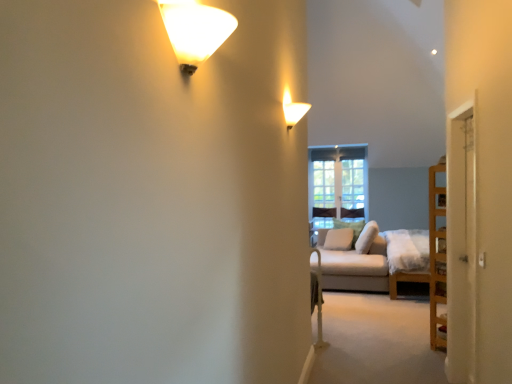
Question: Is white soft pillow at center, the 2th pillow when ordered from front to back, aimed at white fabric couch at right?

Choices:
 (A) no
 (B) yes

Answer: (A)

Question: Does white soft pillow at center, positioned as the second pillow in back-to-front order, appear on the right side of white fabric couch at right?

Choices:
 (A) yes
 (B) no

Answer: (B)

Question: Is white fabric couch at right a part of white soft pillow at center, the 2th pillow when ordered from front to back?

Choices:
 (A) no
 (B) yes

Answer: (A)

Question: Is white soft pillow at center, the 2th pillow when ordered from front to back, in contact with white fabric couch at right?

Choices:
 (A) yes
 (B) no

Answer: (B)

Question: Considering the relative sizes of white soft pillow at center, the 2th pillow when ordered from front to back, and white fabric couch at right in the image provided, is white soft pillow at center, the 2th pillow when ordered from front to back, shorter than white fabric couch at right?

Choices:
 (A) no
 (B) yes

Answer: (B)

Question: Does white soft pillow at center, the 2th pillow when ordered from front to back, have a greater height compared to white fabric couch at right?

Choices:
 (A) yes
 (B) no

Answer: (B)

Question: Can you confirm if matte white wall sconce at upper center, placed as the first lamp when sorted from back to front, is taller than white fabric pillow at center, which is counted as the third pillow, starting from the back?

Choices:
 (A) yes
 (B) no

Answer: (B)

Question: Is matte white wall sconce at upper center, placed as the first lamp when sorted from back to front, to the right of white fabric pillow at center, which is counted as the third pillow, starting from the back, from the viewer's perspective?

Choices:
 (A) no
 (B) yes

Answer: (A)

Question: Does matte white wall sconce at upper center, positioned as the first lamp in right-to-left order, turn towards white fabric pillow at center, which is counted as the third pillow, starting from the back?

Choices:
 (A) yes
 (B) no

Answer: (B)

Question: Would you say matte white wall sconce at upper center, placed as the 2th lamp when sorted from left to right, is outside white fabric pillow at center, the first pillow positioned from the front?

Choices:
 (A) yes
 (B) no

Answer: (A)

Question: From the image's perspective, does matte white wall sconce at upper center, placed as the first lamp when sorted from back to front, appear higher than white fabric pillow at center, the first pillow positioned from the front?

Choices:
 (A) yes
 (B) no

Answer: (A)

Question: Is matte white wall sconce at upper center, positioned as the first lamp in right-to-left order, behind white fabric pillow at center, which is counted as the third pillow, starting from the back?

Choices:
 (A) yes
 (B) no

Answer: (B)

Question: Is white soft pillow at center, the first pillow viewed from the back, outside of white fabric pillow at center, which is counted as the third pillow, starting from the back?

Choices:
 (A) yes
 (B) no

Answer: (A)